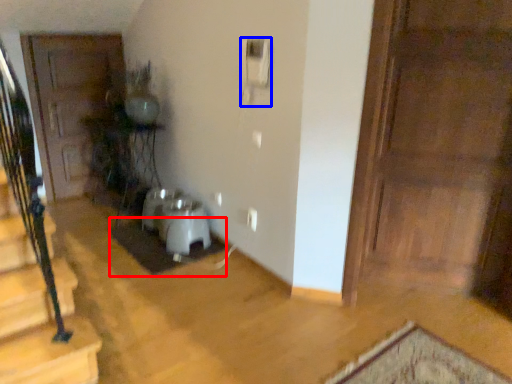
Question: Among these objects, which one is nearest to the camera, doormat (highlighted by a red box) or corded phone (highlighted by a blue box)?

Choices:
 (A) doormat
 (B) corded phone

Answer: (B)